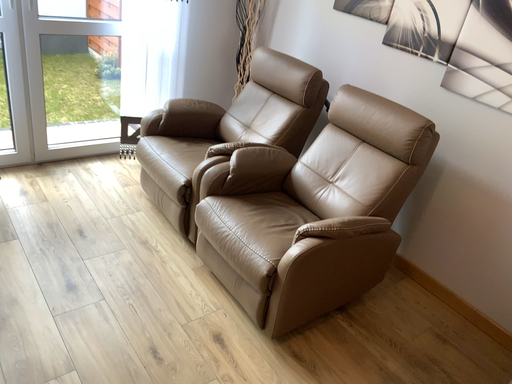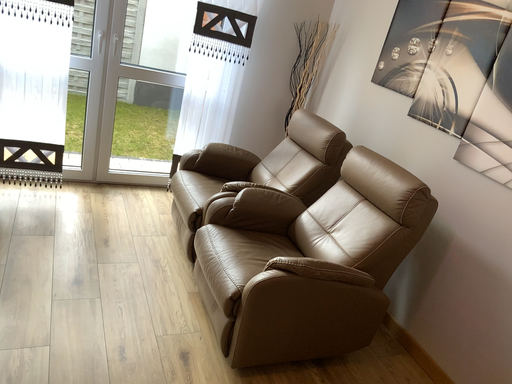
Question: How did the camera likely rotate when shooting the video?

Choices:
 (A) rotated right
 (B) rotated left

Answer: (B)